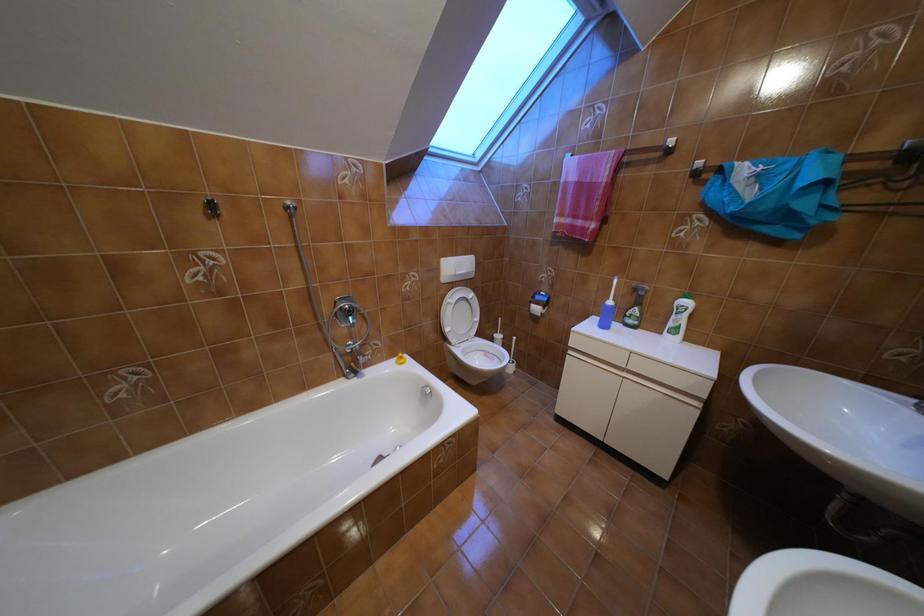
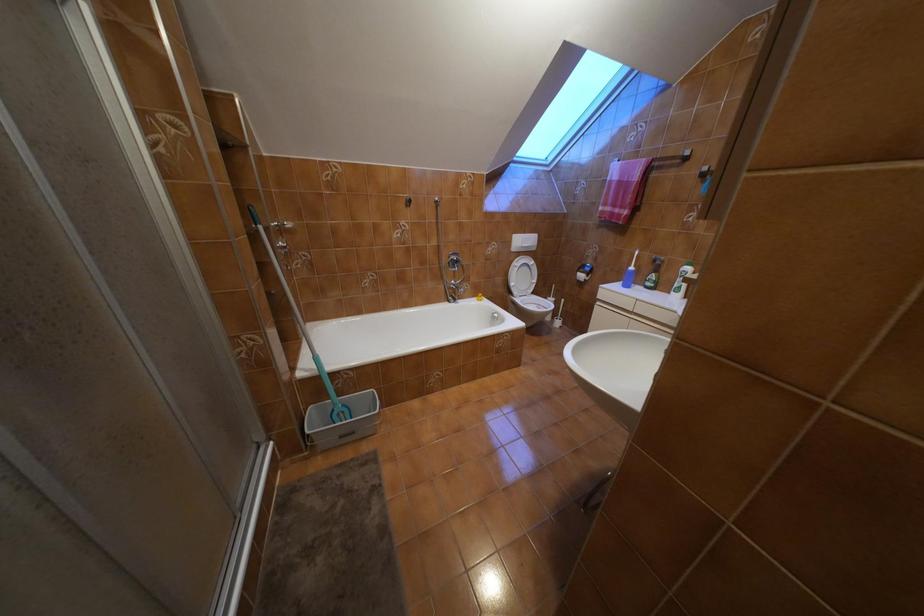
Question: The images are taken continuously from a first-person perspective. In which direction is your viewpoint rotating?

Choices:
 (A) Left
 (B) Right
 (C) Up
 (D) Down

Answer: (A)